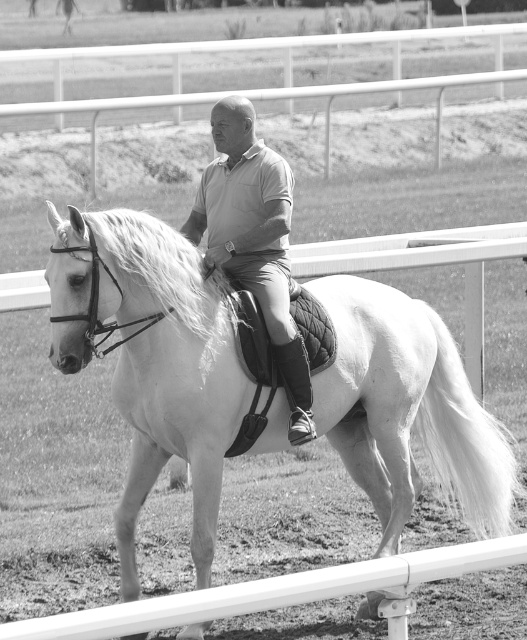
Question: Which object is farther from the camera taking this photo?

Choices:
 (A) matte gray shirt at center
 (B) white matte/suede saddle at center

Answer: (A)

Question: Does white matte/suede saddle at center have a smaller size compared to matte gray shirt at center?

Choices:
 (A) yes
 (B) no

Answer: (B)

Question: Can you confirm if white matte/suede saddle at center is smaller than matte gray shirt at center?

Choices:
 (A) yes
 (B) no

Answer: (B)

Question: Which point is farther from the camera taking this photo?

Choices:
 (A) (385, 352)
 (B) (210, 189)

Answer: (B)

Question: Is white matte/suede saddle at center below matte gray shirt at center?

Choices:
 (A) no
 (B) yes

Answer: (B)